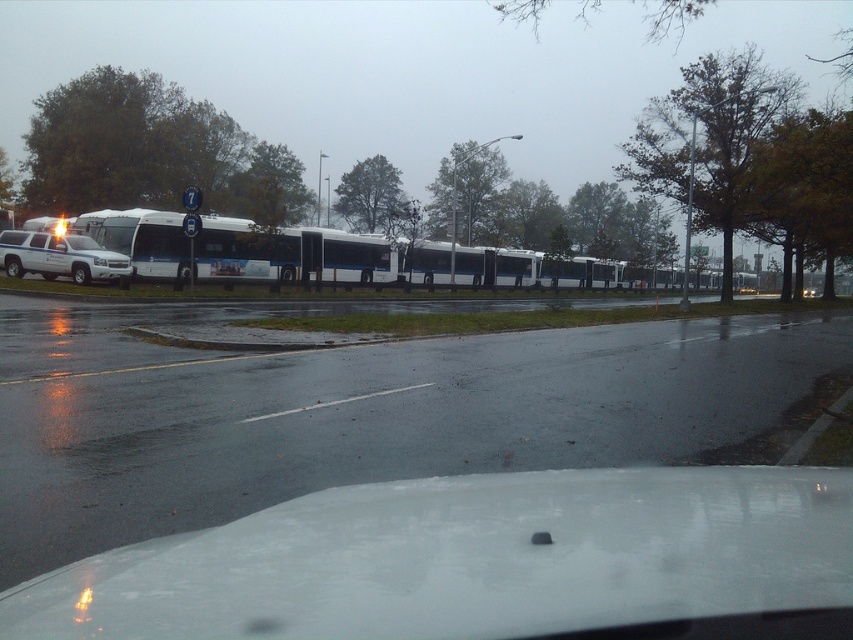
You are a delivery person standing next to your white glossy car at lower center. You need to place a package on the trunk of the car, but you are worried about the distance between you and the car. Can you safely step back to avoid being hit by passing vehicles while placing the package?

The distance between the white glossy car at lower center and the camera is 2.12 meters. Since the delivery person is standing next to the car, stepping back 1 meter would keep them 3.12 meters away from the car, which is a safe distance to avoid passing vehicles.

You are driving a car and want to park in the parking spot between the white glossy car at lower center and the white glossy line at center. Can you fit your car in that space?

The white glossy car at lower center is wider than the white glossy line at center, so the parking space between them may not be large enough to accommodate your car.